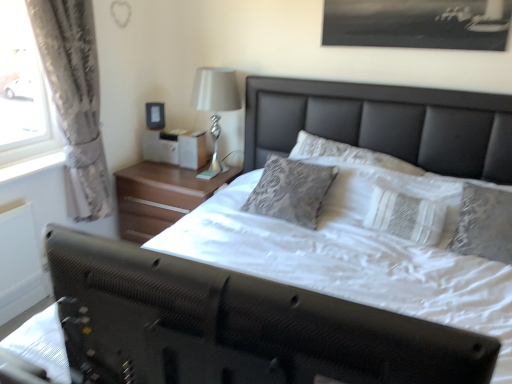
Locate an element on the screen. Image resolution: width=512 pixels, height=384 pixels. free space in front of white glossy lamp at upper right is located at coordinates (194, 187).